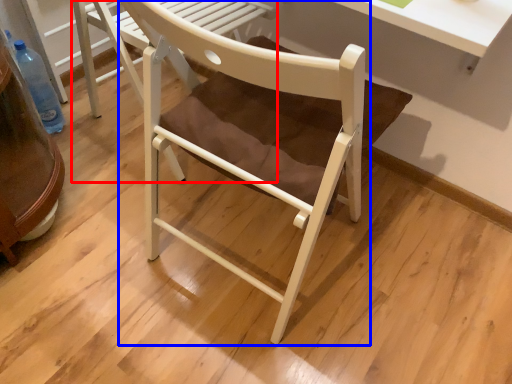
Question: Among these objects, which one is farthest to the camera, chair (highlighted by a red box) or chair (highlighted by a blue box)?

Choices:
 (A) chair
 (B) chair

Answer: (A)